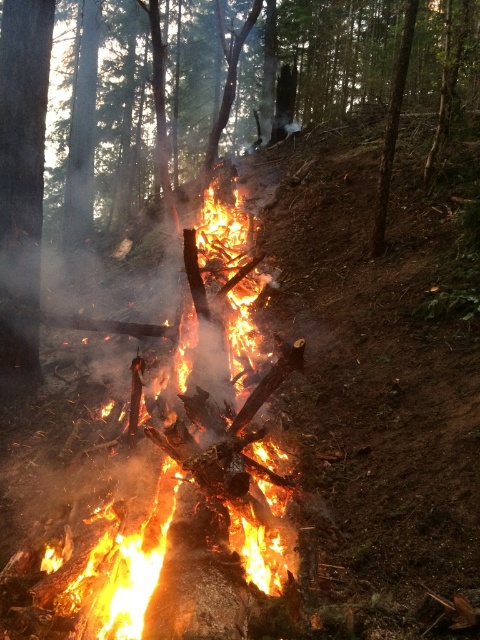
Question: Based on their relative distances, which object is nearer to the charcoal wood fire at center?

Choices:
 (A) flaming wood at center
 (B) smooth bark tree at left

Answer: (B)

Question: Is flaming wood at center bigger than charcoal wood fire at center?

Choices:
 (A) yes
 (B) no

Answer: (B)

Question: Does charcoal wood fire at center have a lesser width compared to smooth bark tree at left?

Choices:
 (A) no
 (B) yes

Answer: (A)

Question: Which of the following is the closest to the observer?

Choices:
 (A) flaming wood at center
 (B) smooth bark tree at left
 (C) charcoal wood fire at center

Answer: (A)

Question: Estimate the real-world distances between objects in this image. Which object is farther from the smooth bark tree at left?

Choices:
 (A) charcoal wood fire at center
 (B) flaming wood at center

Answer: (A)

Question: Can you confirm if charcoal wood fire at center is positioned below smooth bark tree at left?

Choices:
 (A) yes
 (B) no

Answer: (B)